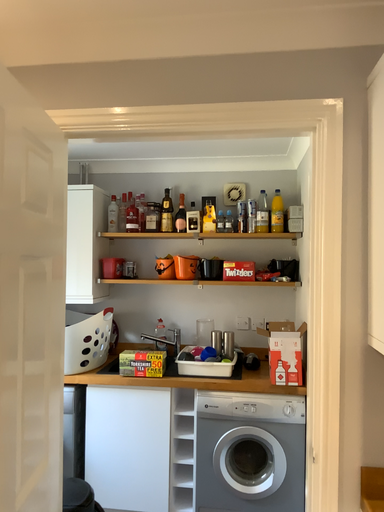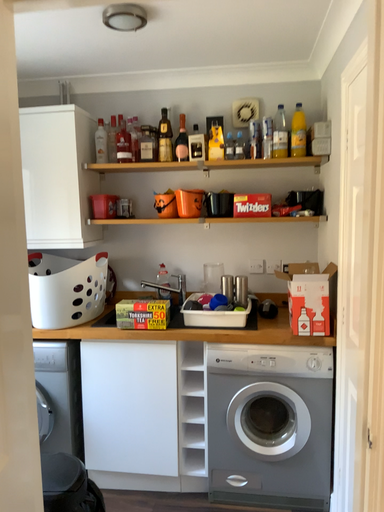
Question: How did the camera likely rotate when shooting the video?

Choices:
 (A) rotated downward
 (B) rotated upward

Answer: (A)